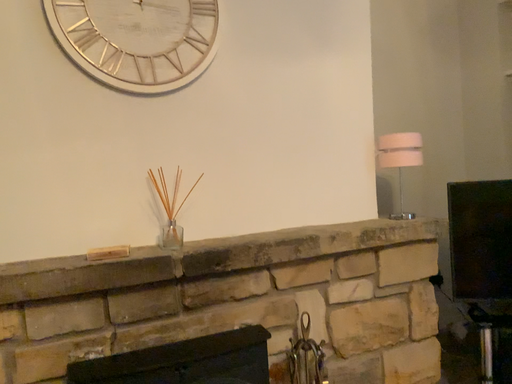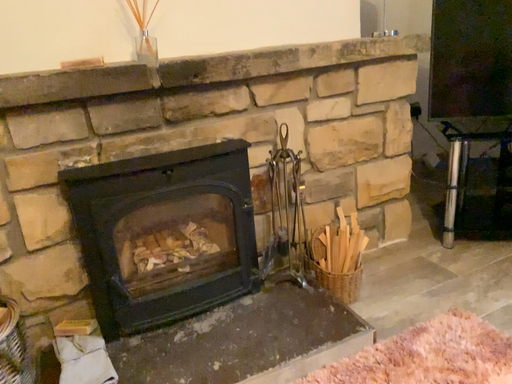
Question: Which way did the camera rotate in the video?

Choices:
 (A) rotated downward
 (B) rotated upward

Answer: (A)